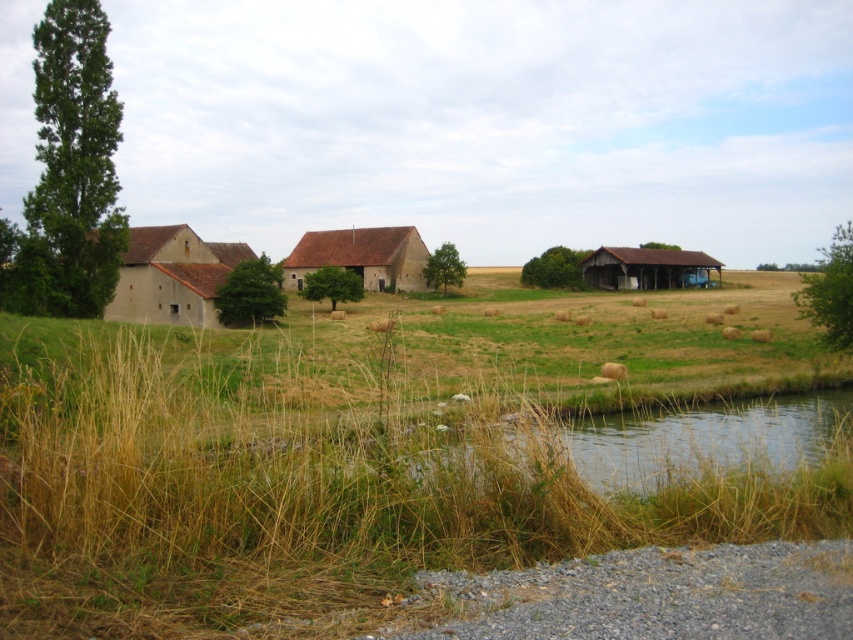
You are a farmer planning to store hay in both the beige stucco barn at left and the brown wooden barn at right. Given their sizes, which barn should you choose for storing a larger quantity of hay?

The brown wooden barn at right is larger than the beige stucco barn at left, so it can store a bigger quantity of hay.

You are standing in the middle of the farm and want to take a photo of both the beige stucco barn at left and the brown wooden barn at right. Which barn should you position yourself closer to in order to have both in the frame without moving your camera angle?

You should position yourself closer to the beige stucco barn at left because it is in front of the brown wooden barn at right, so keeping closer to the foreground barn allows both to stay within the camera frame without needing to adjust the angle.